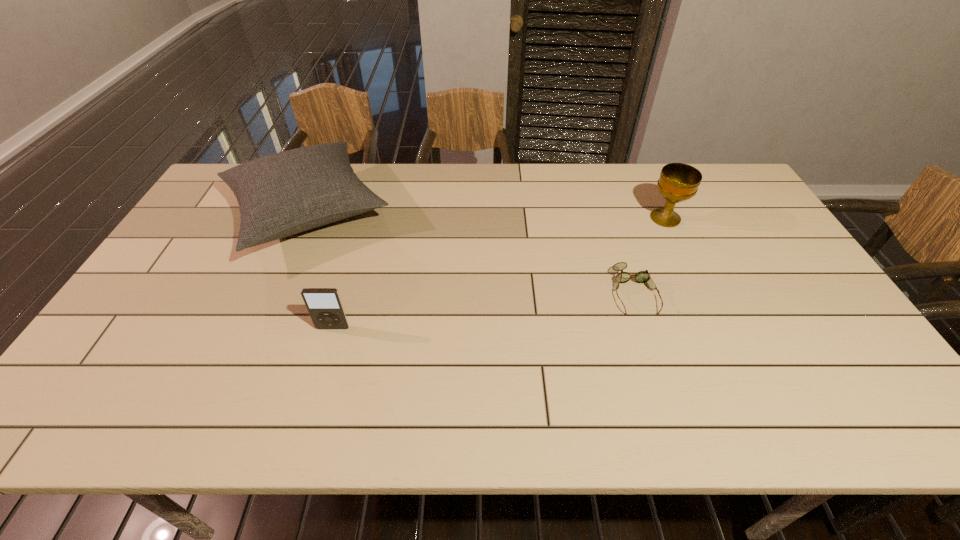
Locate an element on the screen. cushion is located at coordinates (279, 195).

You are a GUI agent. You are given a task and a screenshot of the screen. Output one action in this format:
    pyautogui.click(x=<x>, y=<y>)
    Task: Click on the chalice
    
    Given the screenshot: What is the action you would take?
    pyautogui.click(x=678, y=182)

This screenshot has width=960, height=540. Find the location of `the nearest object`. the nearest object is located at coordinates (325, 307).

Identify the location of the second shortest object. Image resolution: width=960 pixels, height=540 pixels. (325, 307).

What are the coordinates of `spectacles` in the screenshot? It's located at (644, 277).

Locate an element on the screen. Image resolution: width=960 pixels, height=540 pixels. the third object from left to right is located at coordinates (644, 277).

This screenshot has height=540, width=960. I want to click on free space located on the left of the cushion, so click(203, 212).

You are a GUI agent. You are given a task and a screenshot of the screen. Output one action in this format:
    pyautogui.click(x=<x>, y=<y>)
    Task: Click on the vacant area located 0.070m on the front of the chalice
    
    Given the screenshot: What is the action you would take?
    pyautogui.click(x=678, y=245)

In order to click on free location located on the front-facing side of the iPod in this screenshot , I will do `click(325, 354)`.

Locate an element on the screen. This screenshot has width=960, height=540. vacant space positioned on the front-facing side of the third object from left to right is located at coordinates (655, 355).